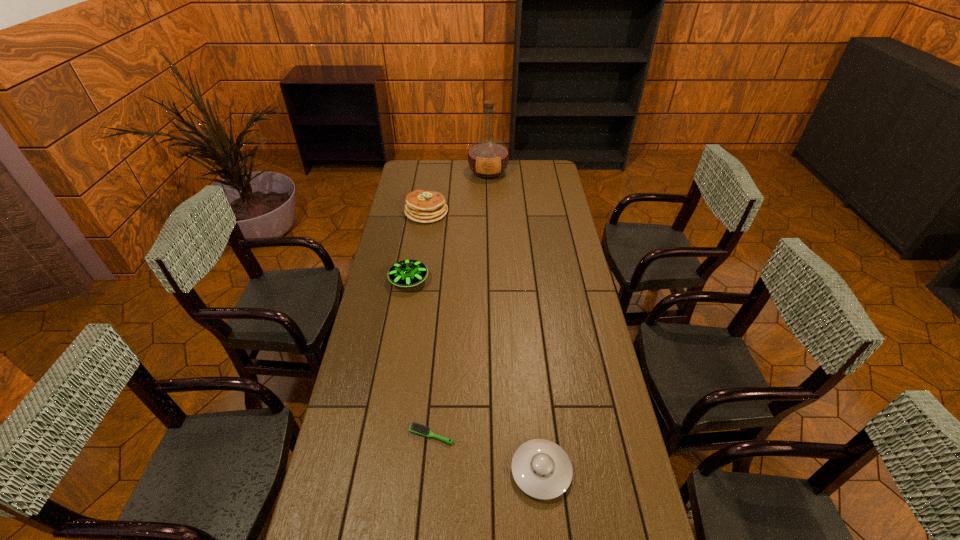
Image resolution: width=960 pixels, height=540 pixels. I want to click on the farthest object, so click(488, 157).

The height and width of the screenshot is (540, 960). Identify the location of the tallest object. (488, 157).

Identify the location of the second tallest object. click(x=421, y=206).

Find the location of `the second farthest object`. the second farthest object is located at coordinates (421, 206).

Where is `the third shortest object`? The height and width of the screenshot is (540, 960). the third shortest object is located at coordinates (407, 273).

The image size is (960, 540). Find the location of `the left saucer`. the left saucer is located at coordinates (407, 273).

At what (x,y) coordinates should I click in order to perform the action: click on the shorter saucer. Please return your answer as a coordinate pair (x, y). The width and height of the screenshot is (960, 540). Looking at the image, I should click on (541, 469).

This screenshot has height=540, width=960. I want to click on the second shortest object, so click(x=541, y=469).

Where is `hairbrush`? This screenshot has height=540, width=960. hairbrush is located at coordinates (417, 428).

Find the location of a particular element. vacant point located 0.360m on the front label of the tallest object is located at coordinates point(490,224).